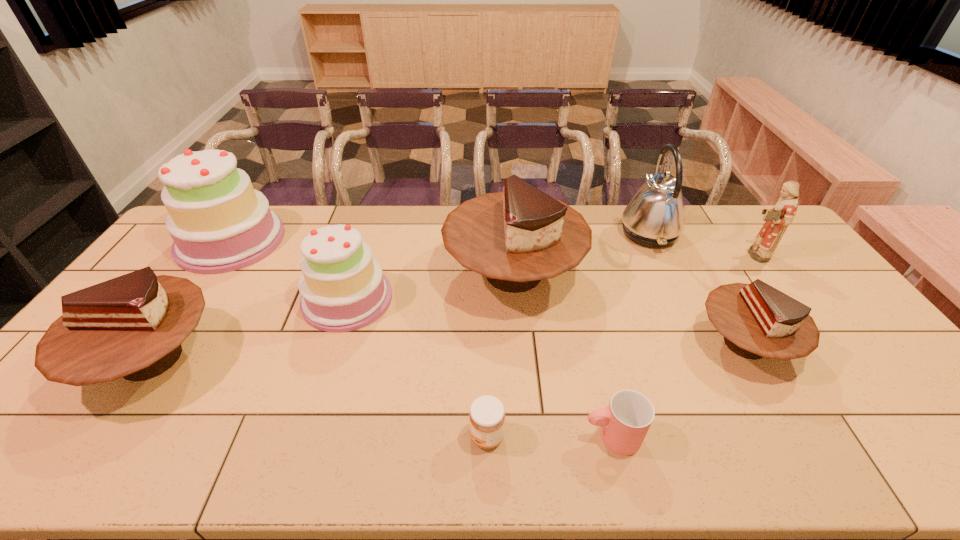
At what (x,y) coordinates should I click in order to perform the action: click on kettle. Please return your answer as a coordinate pair (x, y). Looking at the image, I should click on (654, 217).

Find the location of a particular element. The image size is (960, 540). the left purple cake is located at coordinates (219, 223).

Identify the location of the biggest red cake. The width and height of the screenshot is (960, 540). (516, 238).

You are a GUI agent. You are given a task and a screenshot of the screen. Output one action in this format:
    pyautogui.click(x=<x>, y=<y>)
    Task: Click on the second red cake from right to left
    The height and width of the screenshot is (540, 960).
    Given the screenshot: What is the action you would take?
    pyautogui.click(x=516, y=238)

Locate an element on the screen. The width and height of the screenshot is (960, 540). figurine is located at coordinates (777, 219).

Where is `the seventh object from right to left`? This screenshot has width=960, height=540. the seventh object from right to left is located at coordinates (343, 289).

Locate an element on the screen. the third cake from right to left is located at coordinates [343, 289].

The width and height of the screenshot is (960, 540). What are the coordinates of `the leftmost red cake` in the screenshot? It's located at (132, 326).

Where is `the third shortest object`? the third shortest object is located at coordinates (757, 320).

Locate an element on the screen. This screenshot has width=960, height=540. the smallest red cake is located at coordinates (757, 320).